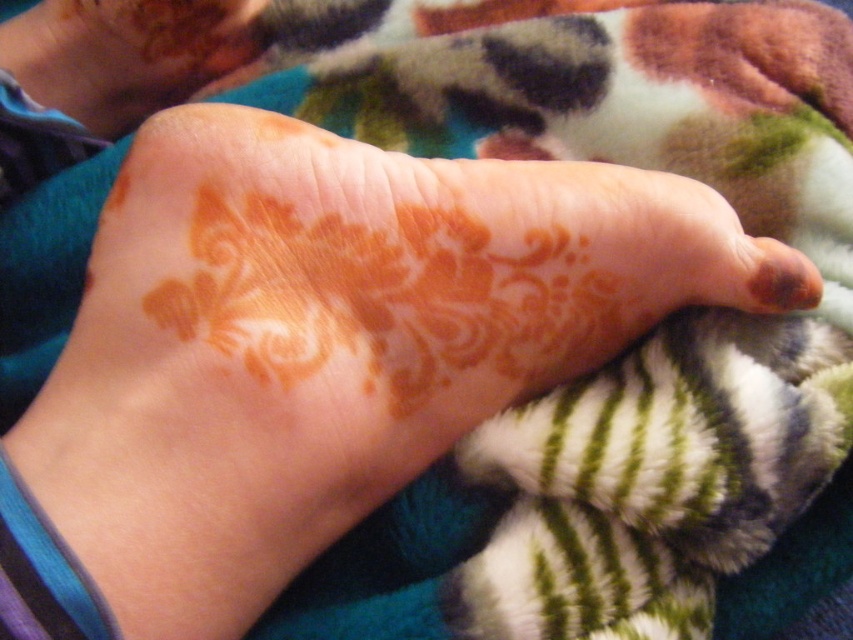
Is point (219, 76) closer to camera compared to point (798, 292)?

No.

Between orange henna tattoo at center and brown matte toe at center, which one has less height?

With less height is brown matte toe at center.

Describe the element at coordinates (125, 54) in the screenshot. I see `orange henna tattoo at center` at that location.

The image size is (853, 640). What are the coordinates of `orange henna tattoo at center` in the screenshot? It's located at (125, 54).